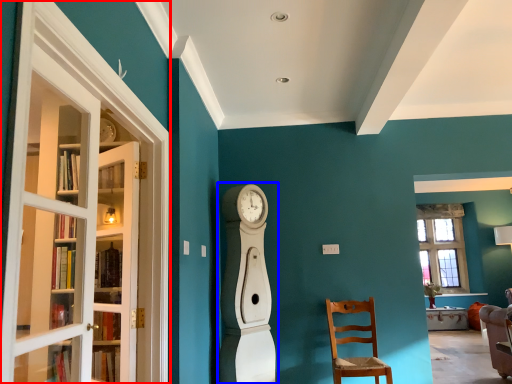
Question: Which of the following is the closest to the observer, screen door (highlighted by a red box) or open (highlighted by a blue box)?

Choices:
 (A) screen door
 (B) open

Answer: (A)